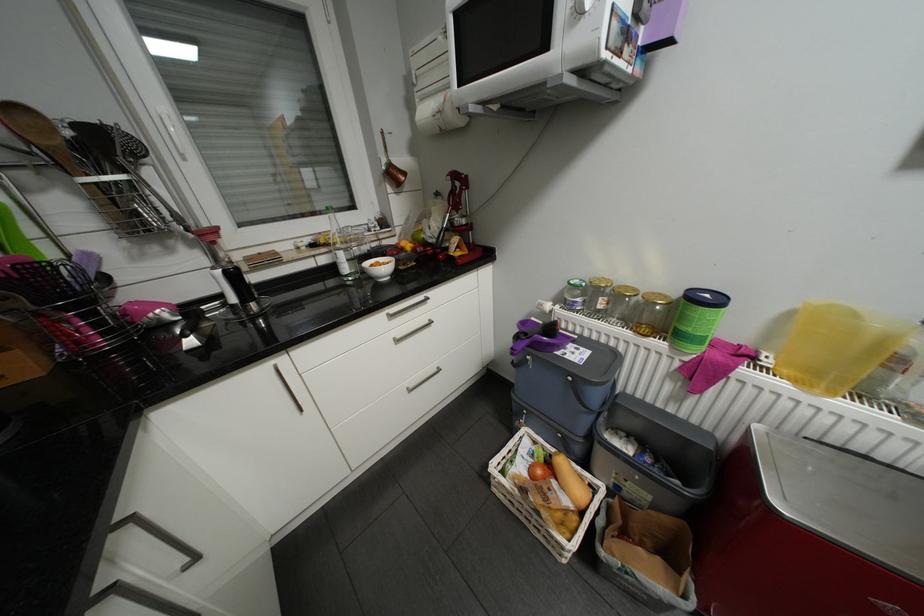
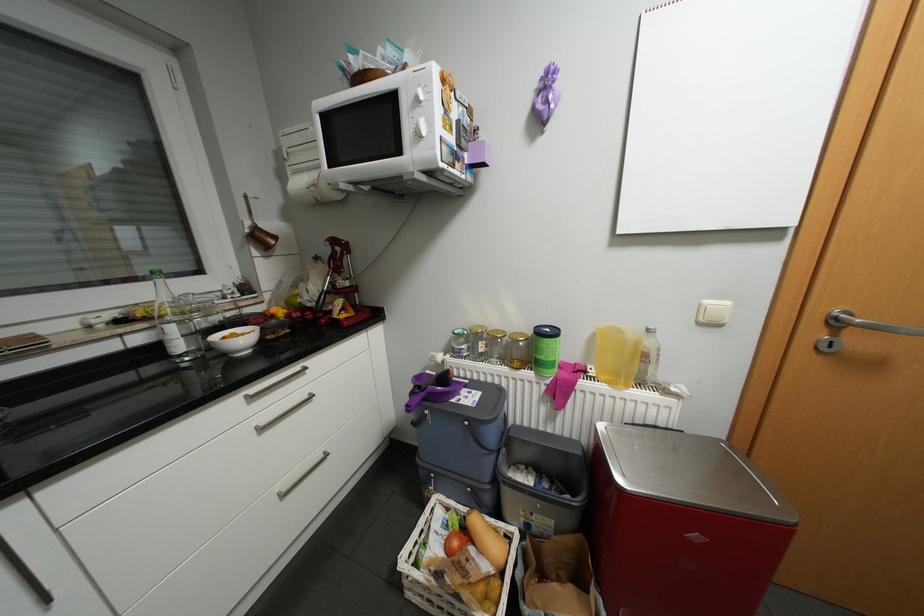
Find the pixel in the second image that matches (679,345) in the first image.

(544, 373)